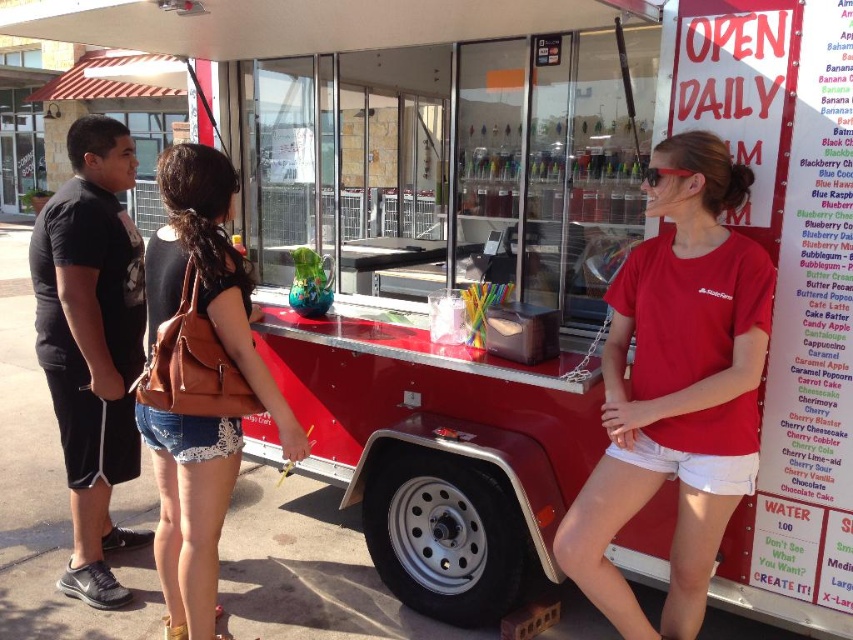
What is the spatial relationship between the brown leather backpack at center and the other objects in the scene?

The brown leather backpack at center is positioned in the central area of the scene, between the young man on the left and the woman on the right, as indicated by its coordinates at point (199,380).

You are standing at the food truck and want to reach a point that is 2 meters away from you. Can you reach the point at coordinates point (664,205)?

The point at coordinates point (664,205) is 2.17 meters away from you, so yes, you can reach it since it is within 2 meters.